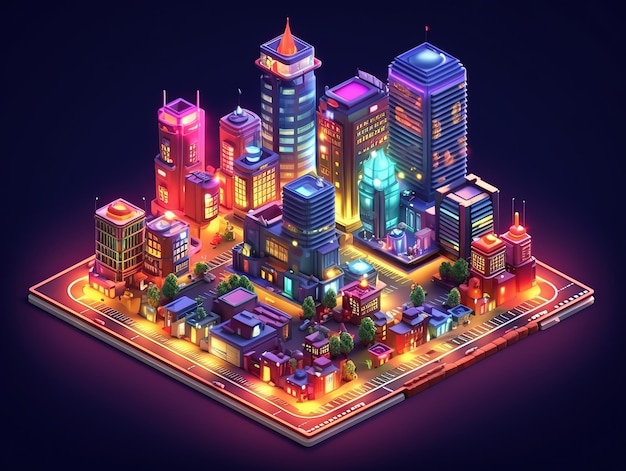
Identify the location of lights. The height and width of the screenshot is (471, 626). (374, 182), (321, 155), (324, 138).